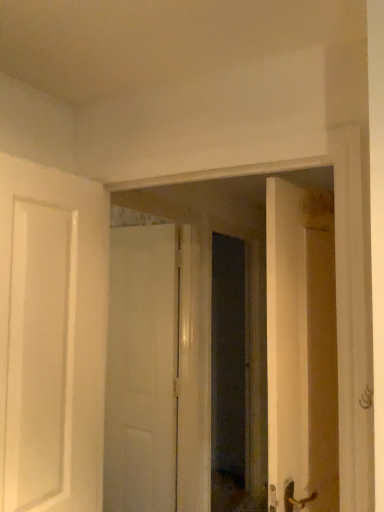
Question: Does transparent glass door at center appear on the right side of white matte door at center?

Choices:
 (A) yes
 (B) no

Answer: (A)

Question: Is transparent glass door at center thinner than white matte door at center?

Choices:
 (A) no
 (B) yes

Answer: (A)

Question: From the image's perspective, is transparent glass door at center beneath white matte door at center?

Choices:
 (A) no
 (B) yes

Answer: (A)

Question: Is transparent glass door at center beside white matte door at center?

Choices:
 (A) yes
 (B) no

Answer: (B)

Question: From a real-world perspective, is transparent glass door at center on white matte door at center?

Choices:
 (A) no
 (B) yes

Answer: (B)

Question: Could white matte door at center be considered to be inside transparent glass door at center?

Choices:
 (A) no
 (B) yes

Answer: (A)

Question: From a real-world perspective, is white matte door at center under transparent glass door at center?

Choices:
 (A) yes
 (B) no

Answer: (A)

Question: Is white matte door at center facing towards transparent glass door at center?

Choices:
 (A) no
 (B) yes

Answer: (A)

Question: From the image's perspective, does white matte door at center appear higher than transparent glass door at center?

Choices:
 (A) yes
 (B) no

Answer: (B)

Question: Considering the relative sizes of white matte door at center and transparent glass door at center in the image provided, is white matte door at center wider than transparent glass door at center?

Choices:
 (A) yes
 (B) no

Answer: (B)

Question: Is white matte door at center taller than transparent glass door at center?

Choices:
 (A) yes
 (B) no

Answer: (A)

Question: Can you confirm if white matte door at center is positioned to the left of transparent glass door at center?

Choices:
 (A) yes
 (B) no

Answer: (A)

Question: Based on their positions, is transparent glass door at center located to the left or right of white matte door at center?

Choices:
 (A) left
 (B) right

Answer: (B)